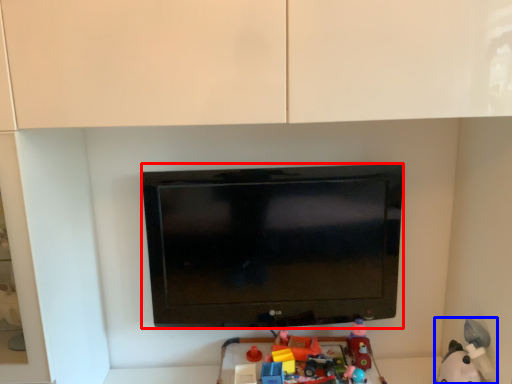
Question: Among these objects, which one is farthest to the camera, television (highlighted by a red box) or toy (highlighted by a blue box)?

Choices:
 (A) television
 (B) toy

Answer: (A)